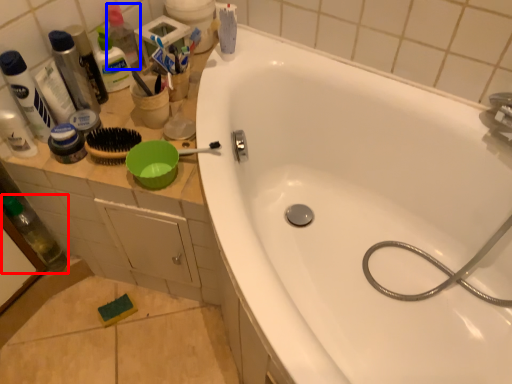
Question: Among these objects, which one is farthest to the camera, bottle (highlighted by a red box) or bottle (highlighted by a blue box)?

Choices:
 (A) bottle
 (B) bottle

Answer: (B)